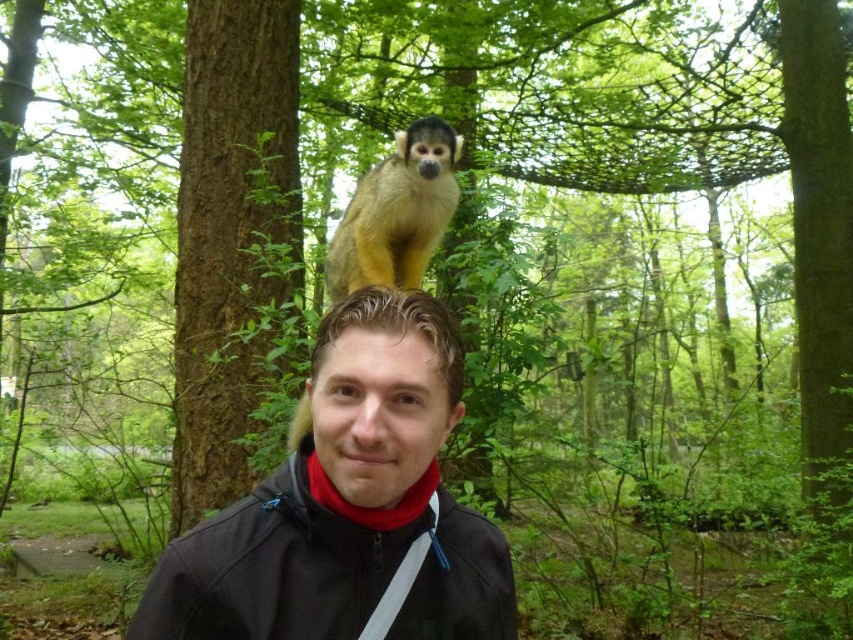
You are a photographer trying to capture the exact location of the matte black jacket at center in the image. The coordinates provided are point (347, 506). Can you confirm if this point accurately represents the position of the matte black jacket at center?

Yes, the point (347, 506) corresponds to the matte black jacket at center, so it accurately represents its position.